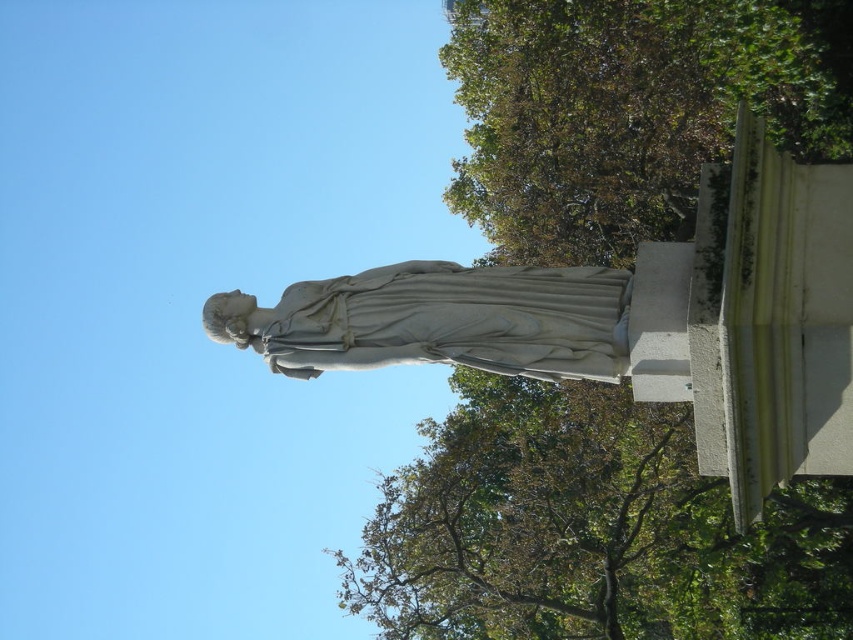
You are a photographer wanting to capture both the green leafy tree at lower center and the white marble statue at center in a single frame. Given that your camera has a fixed focal length, which object should you position closer to the camera to ensure both are in focus?

The green leafy tree at lower center is larger in size compared to the white marble statue at center. To ensure both are in focus, you should position the green leafy tree at lower center closer to the camera since larger objects need to be nearer to maintain focus when paired with smaller ones.

You are an art student standing in front of the white marble statue at center and want to sketch it. There is a green leafy tree at upper right in the background. Which object is closer to you, the observer?

The green leafy tree at upper right is closer to you than the white marble statue at center because it is positioned further to the viewer.